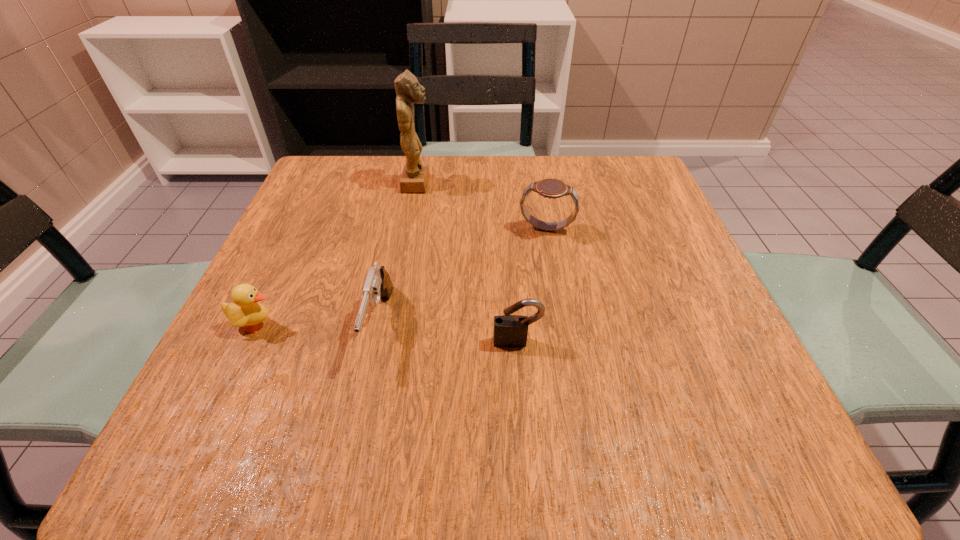
Locate an element on the screen. This screenshot has width=960, height=540. object that can be found as the second closest to the tallest object is located at coordinates (377, 284).

Where is `object that is the second closest to the leftmost object`? This screenshot has height=540, width=960. object that is the second closest to the leftmost object is located at coordinates (510, 331).

Identify the location of vacant area in the image that satisfies the following two spatial constraints: 1. on the front-facing side of the tallest object; 2. at the muzzle of the gun. (392, 324).

Where is `free location that satisfies the following two spatial constraints: 1. on the front-facing side of the fourth nearest object; 2. on the left side of the figurine`? free location that satisfies the following two spatial constraints: 1. on the front-facing side of the fourth nearest object; 2. on the left side of the figurine is located at coordinates (409, 230).

Where is `free space that satisfies the following two spatial constraints: 1. on the front-facing side of the farthest object; 2. on the left side of the fourth nearest object`? This screenshot has width=960, height=540. free space that satisfies the following two spatial constraints: 1. on the front-facing side of the farthest object; 2. on the left side of the fourth nearest object is located at coordinates (409, 230).

Locate an element on the screen. This screenshot has width=960, height=540. vacant point that satisfies the following two spatial constraints: 1. on the front side of the second farthest object; 2. on the front-facing side of the leftmost object is located at coordinates (564, 325).

This screenshot has height=540, width=960. What are the coordinates of `free location that satisfies the following two spatial constraints: 1. at the muzzle of the gun; 2. on the front-facing side of the duckling` in the screenshot? It's located at (379, 325).

You are a GUI agent. You are given a task and a screenshot of the screen. Output one action in this format:
    pyautogui.click(x=<x>, y=<y>)
    Task: Click on the vacant space that satisfies the following two spatial constraints: 1. on the back side of the watch; 2. on the front-facing side of the tallest object
    Image resolution: width=960 pixels, height=540 pixels.
    Given the screenshot: What is the action you would take?
    pyautogui.click(x=539, y=183)